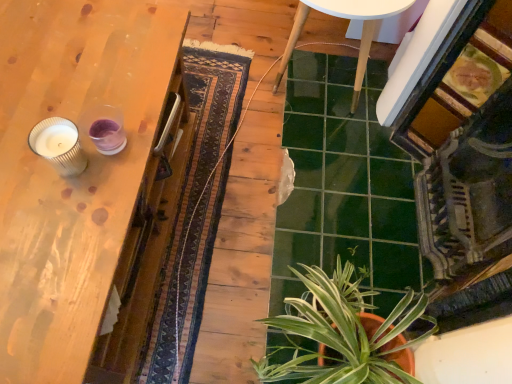
Where is `free point to the left of white glossy table at center`? The width and height of the screenshot is (512, 384). free point to the left of white glossy table at center is located at coordinates (221, 62).